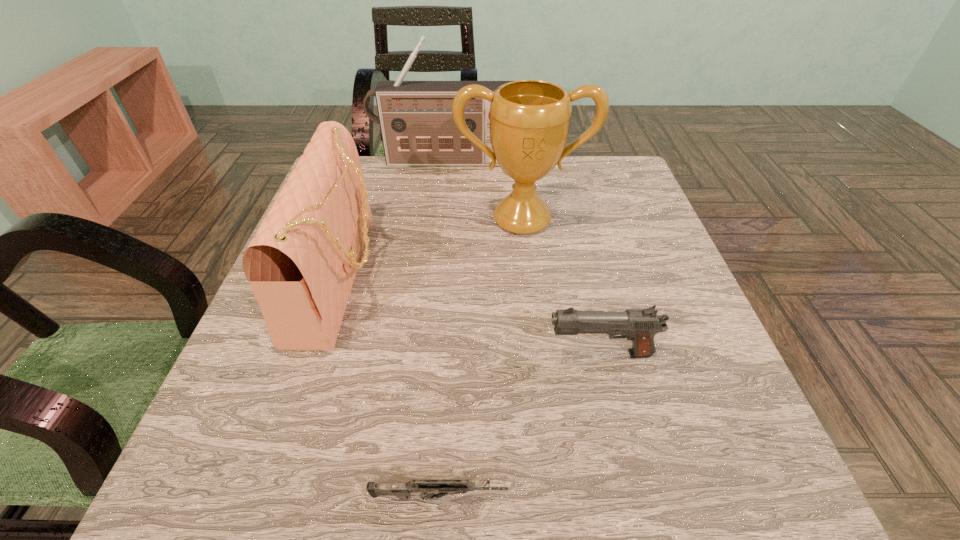
Find the location of `vacant space that's between the award and the fourth tallest object`. vacant space that's between the award and the fourth tallest object is located at coordinates (561, 287).

Where is `vacant area that lies between the radio receiver and the award`? vacant area that lies between the radio receiver and the award is located at coordinates (483, 191).

You are a GUI agent. You are given a task and a screenshot of the screen. Output one action in this format:
    pyautogui.click(x=<x>, y=<y>)
    Task: Click on the empty space between the shortest object and the radio receiver
    
    Given the screenshot: What is the action you would take?
    pyautogui.click(x=442, y=329)

The image size is (960, 540). Find the location of `free point between the handbag and the left gun`. free point between the handbag and the left gun is located at coordinates (390, 386).

Where is `empty space between the nearest object and the farthest object`? empty space between the nearest object and the farthest object is located at coordinates (442, 329).

This screenshot has width=960, height=540. I want to click on free space between the farthest object and the award, so tap(483, 191).

At what (x,y) coordinates should I click in order to perform the action: click on vacant region between the third shortest object and the award. Please return your answer as a coordinate pair (x, y). Looking at the image, I should click on (431, 247).

This screenshot has height=540, width=960. I want to click on vacant region between the award and the farthest object, so click(483, 191).

At what (x,y) coordinates should I click in order to perform the action: click on vacant space in between the nearest object and the second shortest object. Please return your answer as a coordinate pair (x, y). Looking at the image, I should click on (520, 426).

Locate an element on the screen. The height and width of the screenshot is (540, 960). object that is the third nearest to the right gun is located at coordinates (301, 265).